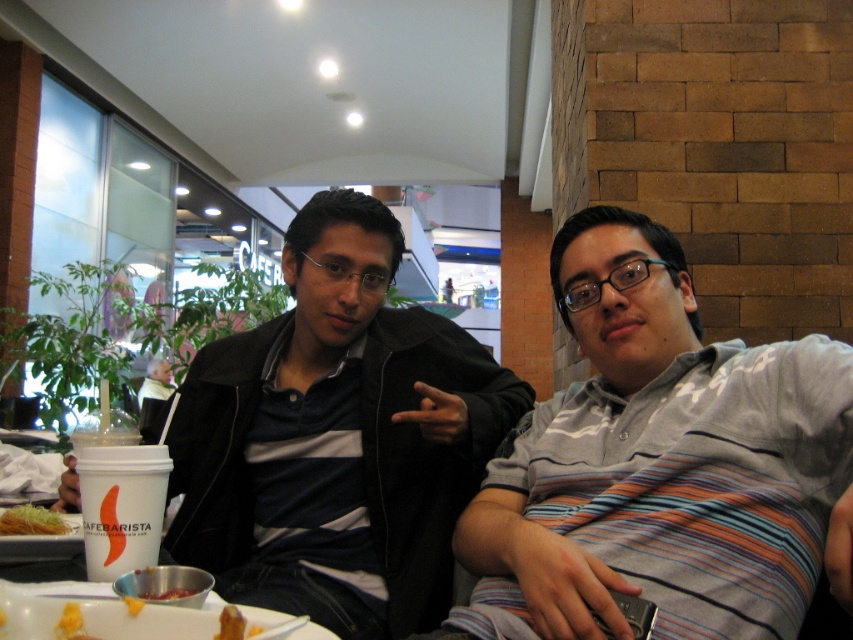
Question: Among these objects, which one is nearest to the camera?

Choices:
 (A) golden crispy noodles at lower left
 (B) gray striped shirt at center
 (C) matte black jacket at center

Answer: (B)

Question: Observing the image, what is the correct spatial positioning of matte black jacket at center in reference to golden crispy noodles at lower left?

Choices:
 (A) above
 (B) below

Answer: (A)

Question: Which point is farther to the camera?

Choices:
 (A) (16, 508)
 (B) (357, 426)

Answer: (B)

Question: Does matte black jacket at center lie in front of golden crispy noodles at lower left?

Choices:
 (A) yes
 (B) no

Answer: (B)

Question: Does gray striped shirt at center have a larger size compared to golden crispy noodles at lower left?

Choices:
 (A) yes
 (B) no

Answer: (A)

Question: Which of the following is the closest to the observer?

Choices:
 (A) gray striped shirt at center
 (B) matte black jacket at center
 (C) golden crispy noodles at lower left
 (D) golden crispy chicken at lower center

Answer: (D)